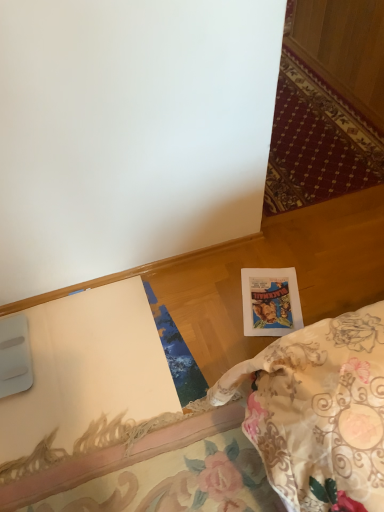
Question: Considering their positions, is printed paper postcard at lower right located in front of or behind white paper at lower right?

Choices:
 (A) front
 (B) behind

Answer: (B)

Question: Do you think printed paper postcard at lower right is within white paper at lower right, or outside of it?

Choices:
 (A) outside
 (B) inside

Answer: (B)

Question: Visually, is printed paper postcard at lower right positioned to the left or to the right of white paper at lower right?

Choices:
 (A) left
 (B) right

Answer: (B)

Question: From a real-world perspective, relative to printed paper postcard at lower right, is white paper at lower right vertically above or below?

Choices:
 (A) below
 (B) above

Answer: (B)

Question: In terms of height, does white paper at lower right look taller or shorter compared to printed paper postcard at lower right?

Choices:
 (A) tall
 (B) short

Answer: (A)

Question: Is white paper at lower right bigger or smaller than printed paper postcard at lower right?

Choices:
 (A) small
 (B) big

Answer: (B)

Question: Do you think white paper at lower right is within printed paper postcard at lower right, or outside of it?

Choices:
 (A) outside
 (B) inside

Answer: (A)